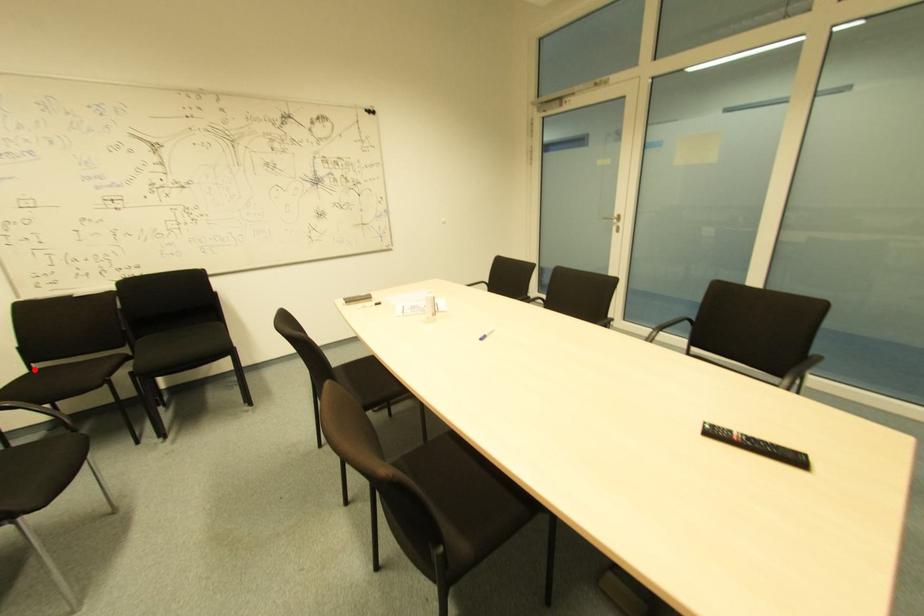
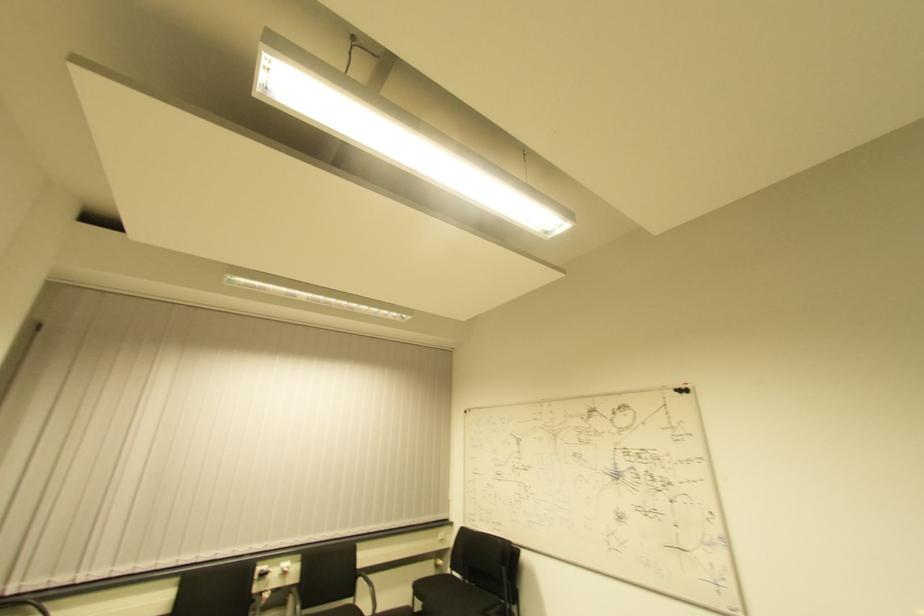
Question: I am providing you with two images of the same scene from different viewpoints. A red point is marked on the first image. Can you still see the location of the red point in image 2?

Choices:
 (A) Yes
 (B) No

Answer: (A)